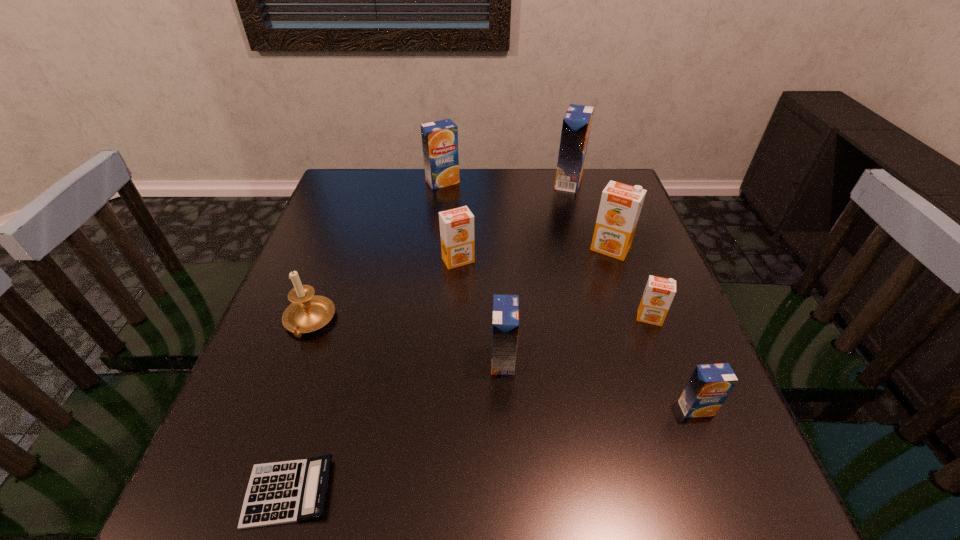
Identify the location of vacant position in the image that satisfies the following two spatial constraints: 1. on the front side of the biggest orange orange juice; 2. on the right side of the biggest blue orange_juice. (588, 249).

Find the location of `free location that satisfies the following two spatial constraints: 1. on the back side of the calculator; 2. on the left side of the second biggest orange orange juice`. free location that satisfies the following two spatial constraints: 1. on the back side of the calculator; 2. on the left side of the second biggest orange orange juice is located at coordinates tap(359, 260).

This screenshot has height=540, width=960. In order to click on free space that satisfies the following two spatial constraints: 1. on the back side of the second nearest object; 2. on the right side of the nearest object in this screenshot , I will do `click(314, 408)`.

This screenshot has height=540, width=960. I want to click on free region that satisfies the following two spatial constraints: 1. on the front side of the nearest blue orange_juice; 2. on the left side of the biggest orange orange juice, so click(x=664, y=408).

Find the location of a particular element. This screenshot has width=960, height=540. free space that satisfies the following two spatial constraints: 1. on the front side of the rightmost blue orange_juice; 2. on the left side of the biggest orange orange juice is located at coordinates (664, 408).